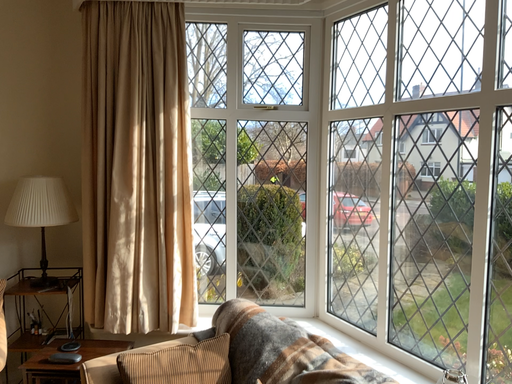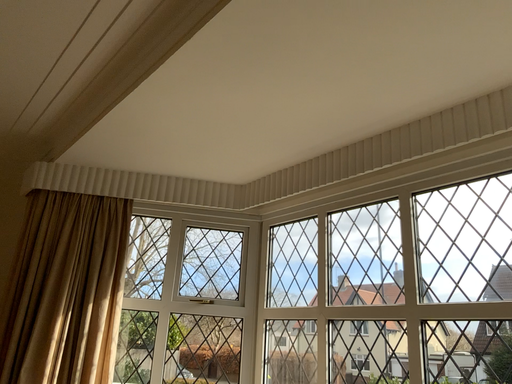
Question: Which way did the camera rotate in the video?

Choices:
 (A) rotated left
 (B) rotated right

Answer: (B)